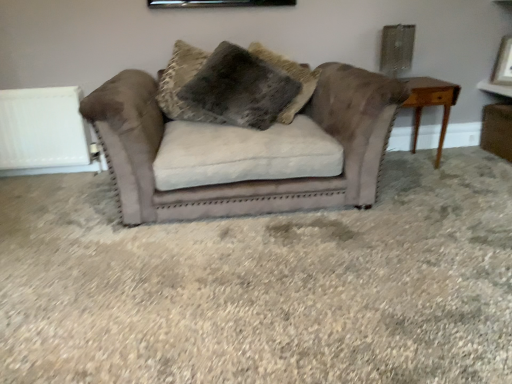
Question: Would you say white matte radiator at left is to the left or to the right of fuzzy brown pillow at center in the picture?

Choices:
 (A) left
 (B) right

Answer: (A)

Question: Is point (76, 99) closer or farther from the camera than point (221, 122)?

Choices:
 (A) farther
 (B) closer

Answer: (A)

Question: Based on their relative distances, which object is nearer to the suede couch at center?

Choices:
 (A) white matte radiator at left
 (B) light brown wooden table at right
 (C) fuzzy brown pillow at center
 (D) matte white picture frame at upper right

Answer: (C)

Question: Which object is the closest to the matte white picture frame at upper right?

Choices:
 (A) suede couch at center
 (B) white matte radiator at left
 (C) light brown wooden table at right
 (D) fuzzy brown pillow at center

Answer: (C)